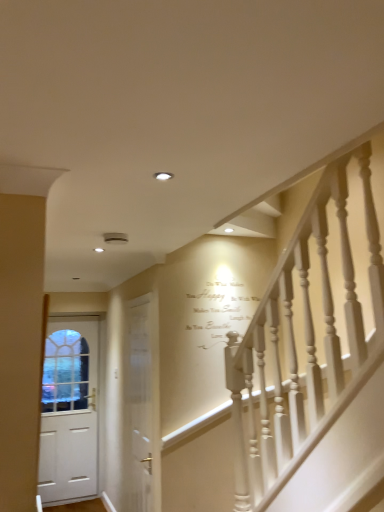
Question: Would you say white wooden door at center, the 2th door viewed from the back, is outside white matte door at left, the 1th door when ordered from left to right?

Choices:
 (A) yes
 (B) no

Answer: (A)

Question: Is white matte door at left, the 1th door positioned from the back, surrounded by white wooden door at center, the 2th door viewed from the back?

Choices:
 (A) yes
 (B) no

Answer: (B)

Question: Is white wooden door at center, which is the first door from front to back, at the left side of white matte door at left, the 1th door positioned from the back?

Choices:
 (A) no
 (B) yes

Answer: (A)

Question: Can you confirm if white wooden door at center, the 2th door viewed from the back, is bigger than white matte door at left, the 1th door when ordered from left to right?

Choices:
 (A) yes
 (B) no

Answer: (B)

Question: Is white wooden door at center, which is the first door from front to back, positioned with its back to white matte door at left, which is the 2th door from front to back?

Choices:
 (A) yes
 (B) no

Answer: (B)

Question: Considering the relative sizes of white wooden door at center, which is the first door from front to back, and white matte door at left, the 1th door positioned from the back, in the image provided, is white wooden door at center, which is the first door from front to back, taller than white matte door at left, the 1th door positioned from the back,?

Choices:
 (A) yes
 (B) no

Answer: (B)

Question: Considering the relative sizes of white matte door at left, the 1th door positioned from the back, and white wooden door at center, which is the first door from front to back, in the image provided, is white matte door at left, the 1th door positioned from the back, wider than white wooden door at center, which is the first door from front to back,?

Choices:
 (A) no
 (B) yes

Answer: (B)

Question: Is white matte door at left, the 1th door positioned from the back, aimed at white wooden door at center, which appears as the first door when viewed from the right?

Choices:
 (A) no
 (B) yes

Answer: (B)

Question: Considering the relative positions of white matte door at left, the 1th door when ordered from left to right, and white wooden door at center, the 2th door viewed from the back, in the image provided, is white matte door at left, the 1th door when ordered from left to right, to the left of white wooden door at center, the 2th door viewed from the back, from the viewer's perspective?

Choices:
 (A) no
 (B) yes

Answer: (B)

Question: From a real-world perspective, does white matte door at left, the 1th door when ordered from left to right, sit lower than white wooden door at center, which is the first door from front to back?

Choices:
 (A) yes
 (B) no

Answer: (A)

Question: Considering the relative sizes of white matte door at left, which is the 2th door from front to back, and white wooden door at center, which ranks as the 2th door in left-to-right order, in the image provided, is white matte door at left, which is the 2th door from front to back, bigger than white wooden door at center, which ranks as the 2th door in left-to-right order,?

Choices:
 (A) yes
 (B) no

Answer: (A)

Question: Does white matte door at left, which is the 2th door from front to back, have a greater height compared to white wooden door at center, which appears as the first door when viewed from the right?

Choices:
 (A) yes
 (B) no

Answer: (A)

Question: Is white wooden door at center, the 2th door viewed from the back, situated inside white matte door at left, which is the 2th door from front to back, or outside?

Choices:
 (A) outside
 (B) inside

Answer: (A)